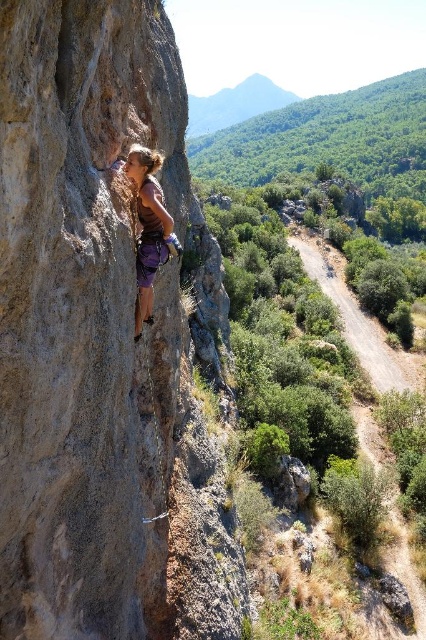
Looking at this image, which is above, brown rough rock at left or purple fabric climbing harness at center?

purple fabric climbing harness at center

Between point (17, 250) and point (141, 300), which one is positioned behind?

Point (141, 300)

Which is in front, point (195, 291) or point (161, 253)?

Point (161, 253) is in front.

Find the location of `brown rough rock at left`. brown rough rock at left is located at coordinates (103, 342).